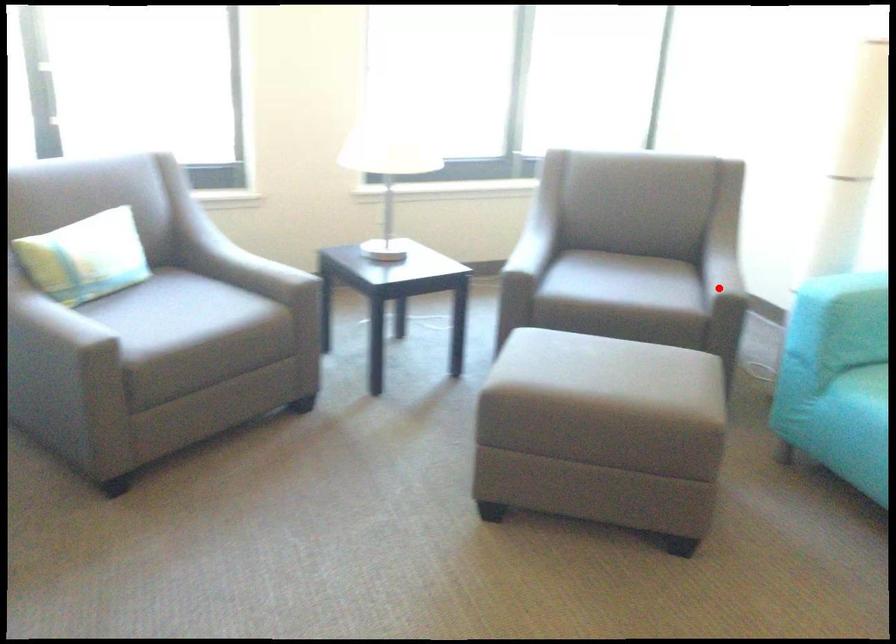
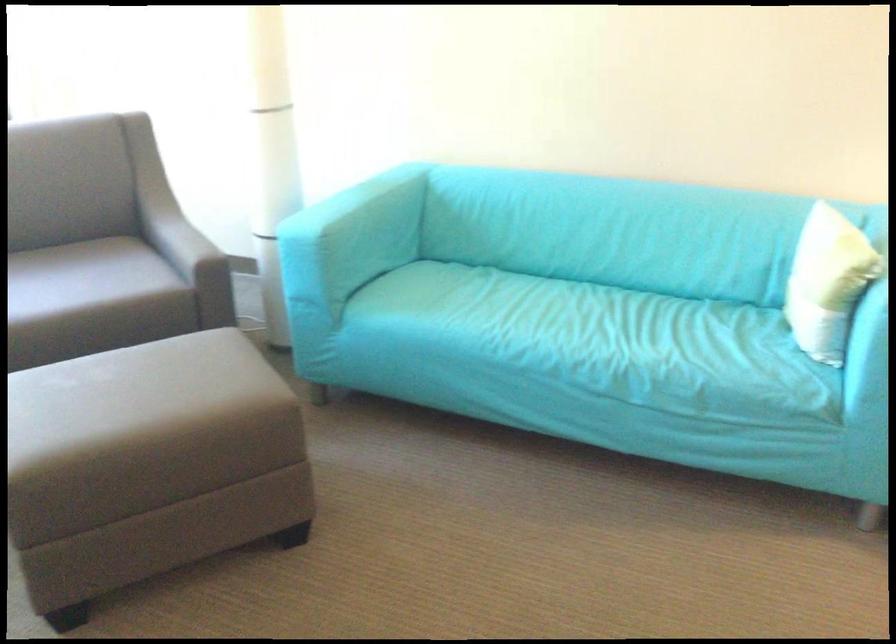
Locate, in the second image, the point that corresponds to the highlighted location in the first image.

(188, 251)